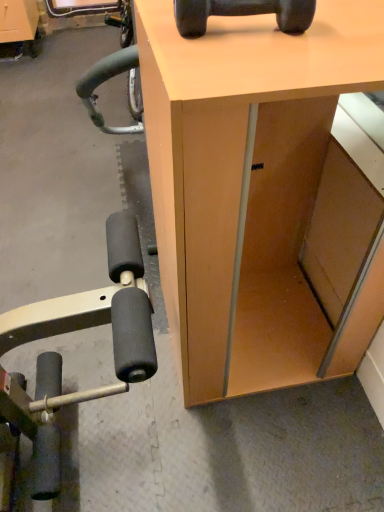
Identify the location of unoccupied region to the right of black rubber dumbbell at upper center. Image resolution: width=384 pixels, height=512 pixels. (340, 30).